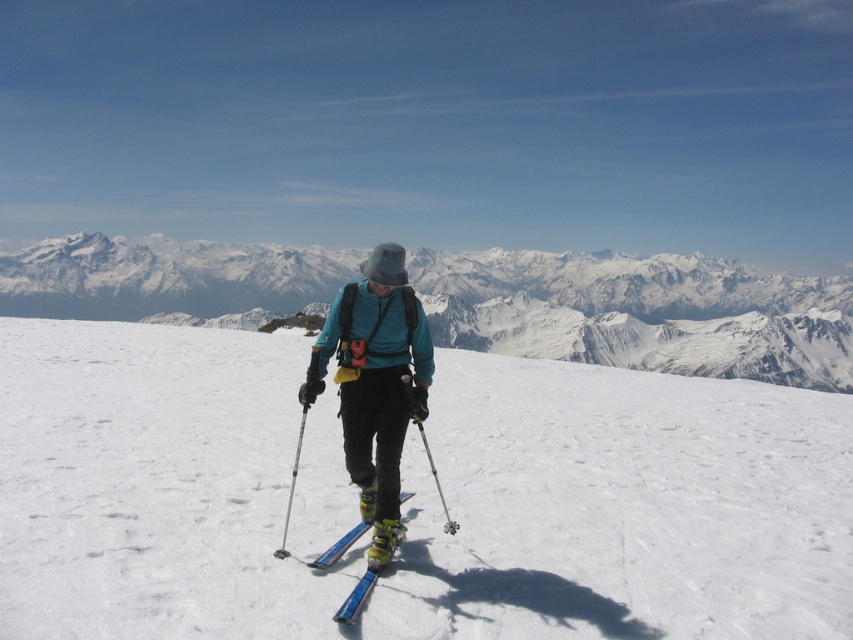
Question: Which object appears closest to the camera in this image?

Choices:
 (A) metallic silver ski pole at center
 (B) white snow mountain at center
 (C) white matte snow at center

Answer: (C)

Question: Is matte blue jacket at center closer to the viewer compared to metallic silver ski pole at center?

Choices:
 (A) yes
 (B) no

Answer: (A)

Question: Which object is positioned closest to the metallic silver ski pole at center?

Choices:
 (A) matte blue jacket at center
 (B) blue metallic ski at center
 (C) white matte snow at center

Answer: (A)

Question: Can you confirm if blue metallic ski at center is positioned to the right of metallic silver ski pole at center?

Choices:
 (A) no
 (B) yes

Answer: (A)

Question: Can you confirm if white snow mountain at center is wider than matte blue jacket at center?

Choices:
 (A) no
 (B) yes

Answer: (B)

Question: Which is farther from the matte blue jacket at center?

Choices:
 (A) white matte snow at center
 (B) white snow mountain at center

Answer: (B)